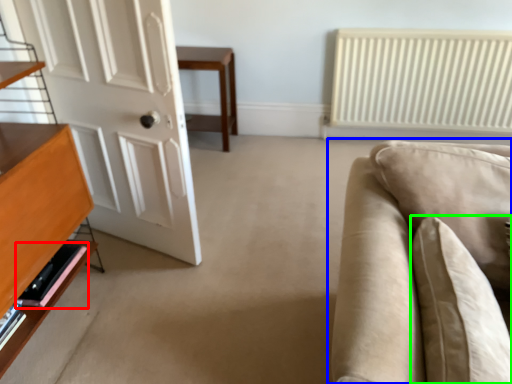
Question: Estimate the real-world distances between objects in this image. Which object is closer to shelf (highlighted by a red box), studio couch (highlighted by a blue box) or pillow (highlighted by a green box)?

Choices:
 (A) studio couch
 (B) pillow

Answer: (A)